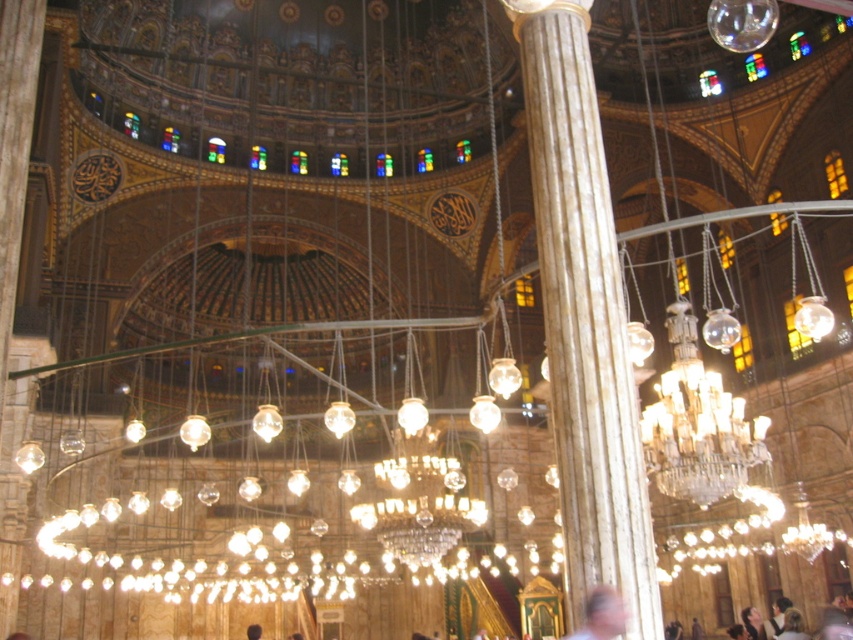
Does blurred skin at center have a lesser width compared to blonde hair at center?

Correct, blurred skin at center's width is less than blonde hair at center's.

Is point (624, 621) closer to viewer compared to point (781, 632)?

Yes, it is in front of point (781, 632).

Which is behind, point (607, 632) or point (796, 634)?

The point (796, 634) is more distant.

This screenshot has height=640, width=853. I want to click on blurred skin at center, so click(x=602, y=616).

Does white marble column at center have a larger size compared to blurred skin at center?

Indeed, white marble column at center has a larger size compared to blurred skin at center.

At what (x,y) coordinates should I click in order to perform the action: click on white marble column at center. Please return your answer as a coordinate pair (x, y). The image size is (853, 640). Looking at the image, I should click on (584, 317).

Identify the location of white marble column at center. (584, 317).

Measure the distance from blurred skin at center to dark brown hair at center.

83.88 meters

Is point (616, 611) behind point (259, 630)?

No, (616, 611) is in front of (259, 630).

Where is `blurred skin at center`? blurred skin at center is located at coordinates (602, 616).

This screenshot has width=853, height=640. What are the coordinates of `blurred skin at center` in the screenshot? It's located at (602, 616).